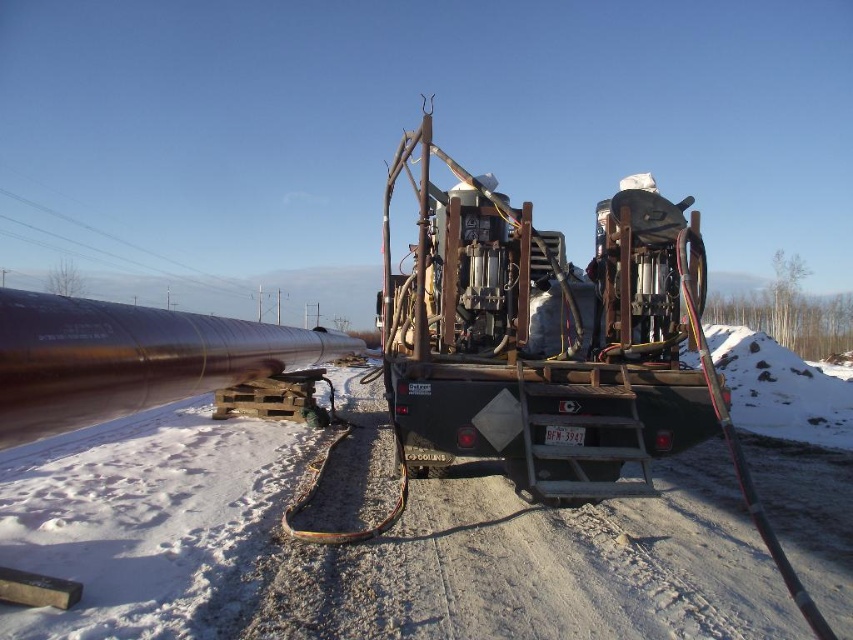
Between white powdery snow at center and metallic brown trailer truck at center, which one is positioned higher?

metallic brown trailer truck at center is higher up.

Can you confirm if white powdery snow at center is positioned to the right of metallic brown trailer truck at center?

Indeed, white powdery snow at center is positioned on the right side of metallic brown trailer truck at center.

Between point (480, 538) and point (416, 378), which one is positioned in front?

Point (416, 378) is in front.

Where is `white powdery snow at center`? white powdery snow at center is located at coordinates (366, 547).